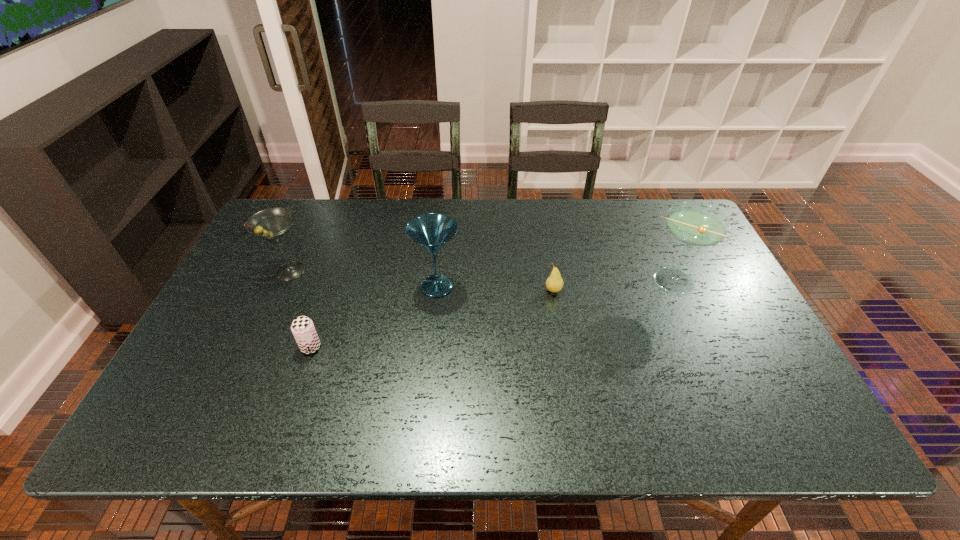
At what (x,y) coordinates should I click in order to perform the action: click on the second closest martini to the rightmost martini. Please return your answer as a coordinate pair (x, y). The image size is (960, 540). Looking at the image, I should click on 273,224.

This screenshot has width=960, height=540. In order to click on vacant point that satisfies the following two spatial constraints: 1. on the front side of the leftmost object; 2. on the right side of the rightmost martini in this screenshot , I will do `click(286, 281)`.